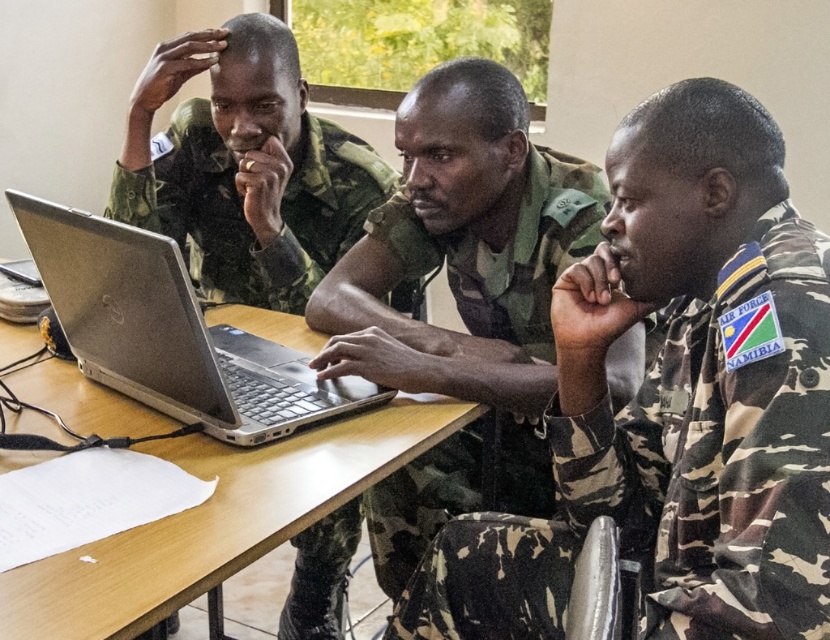
You are a photographer standing at a distance. You want to take a closeup shot of the camouflage fabric uniform at center. The camera you are using has a minimum focusing distance of 30 inches. Can you take the photo without moving closer?

The camouflage fabric uniform at center is 34.17 inches away from viewer. Since the minimum focusing distance is 30 inches, you can take the photo without moving closer because the distance is within the camera s capability.

You are a photographer trying to capture a group photo of the three individuals in the scene. Since you want to ensure that the camouflage uniform at center and the wooden table at center are both clearly visible in the frame, which object should you focus on first to ensure proper depth of field?

The camouflage uniform at center is bigger than the wooden table at center, so focusing on the camouflage uniform at center first will ensure proper depth of field for both objects.

What is located at the coordinates point (721,449) in the image?

The point (721,449) indicates the camouflage fabric uniform at center.